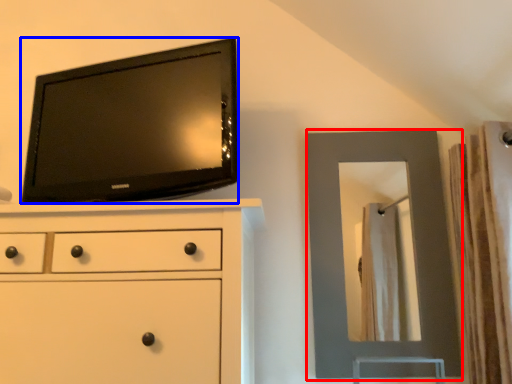
Question: Which object is further to the camera taking this photo, mirror (highlighted by a red box) or television (highlighted by a blue box)?

Choices:
 (A) mirror
 (B) television

Answer: (A)